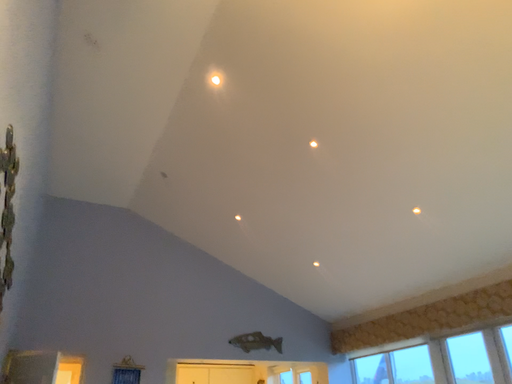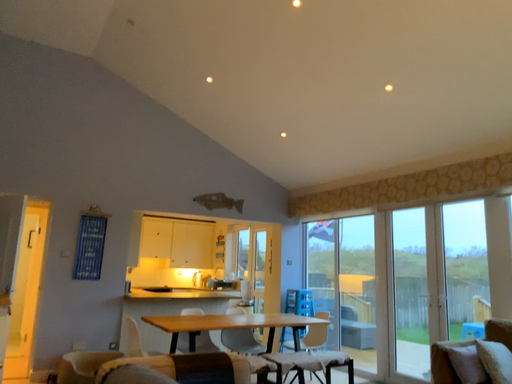
Question: How did the camera likely rotate when shooting the video?

Choices:
 (A) rotated downward
 (B) rotated upward

Answer: (A)